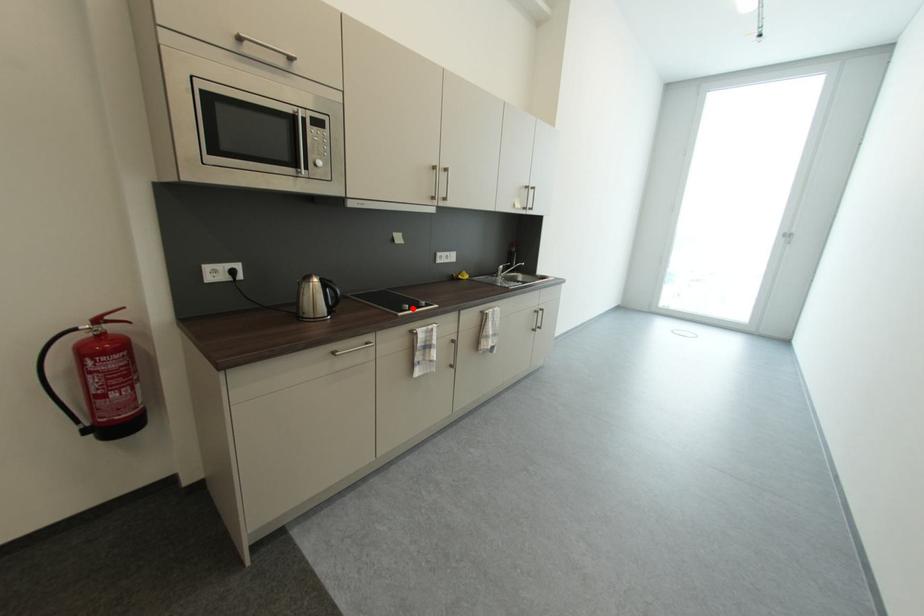
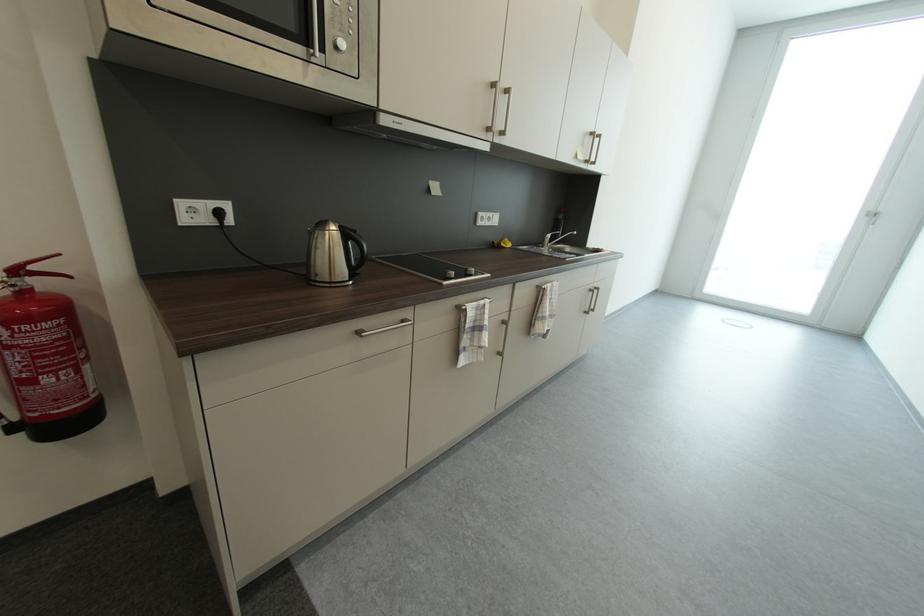
Find the pixel in the second image that matches the highlighted location in the first image.

(458, 275)